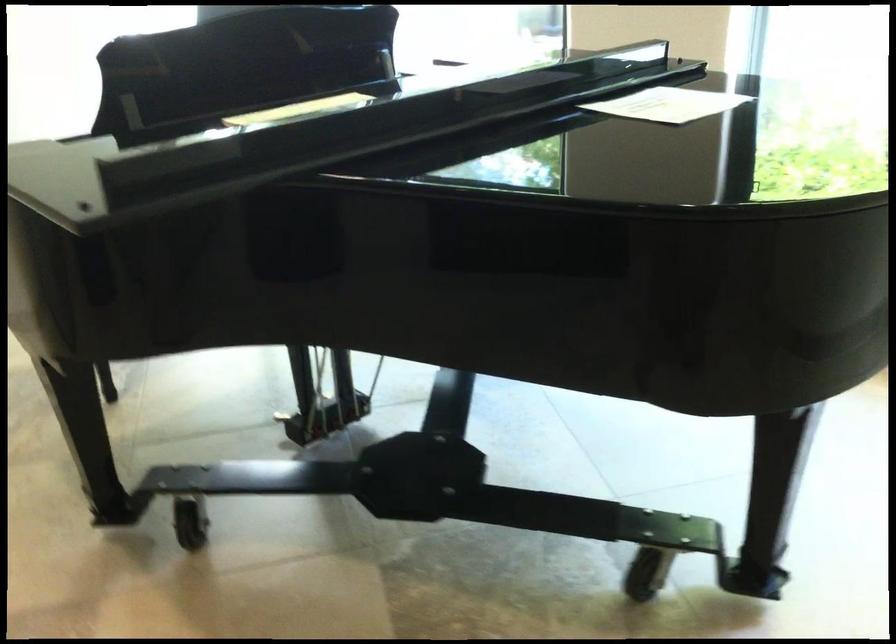
What do you see at coordinates (322, 399) in the screenshot?
I see `a piano pedal` at bounding box center [322, 399].